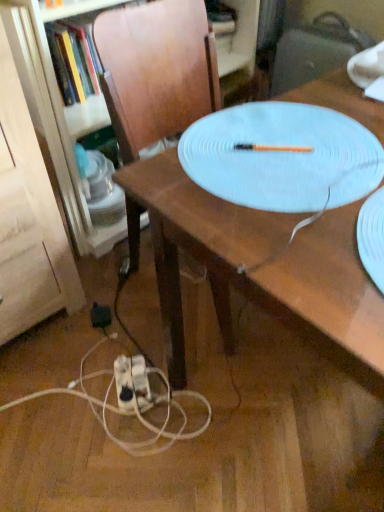
Question: Is white textured platter at center taller or shorter than wooden table at center?

Choices:
 (A) short
 (B) tall

Answer: (A)

Question: Is white textured platter at center situated inside wooden table at center or outside?

Choices:
 (A) inside
 (B) outside

Answer: (A)

Question: Considering the real-world distances, which object is closest to the white plastic extension cord at lower center?

Choices:
 (A) black plastic electric outlet at lower left
 (B) wooden table at center
 (C) white textured platter at center

Answer: (A)

Question: Which is farther from the white textured platter at center?

Choices:
 (A) white plastic extension cord at lower center
 (B) wooden table at center
 (C) black plastic electric outlet at lower left

Answer: (C)